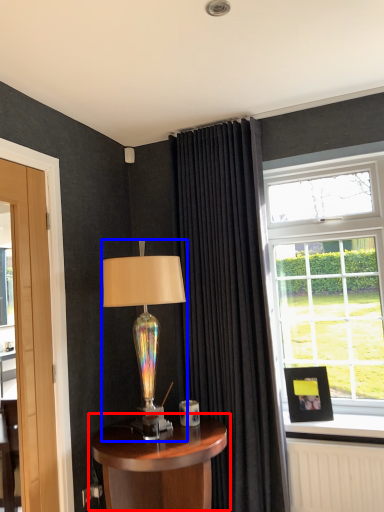
Question: Which point is closer to the camera, table (highlighted by a red box) or lamp (highlighted by a blue box)?

Choices:
 (A) table
 (B) lamp

Answer: (A)